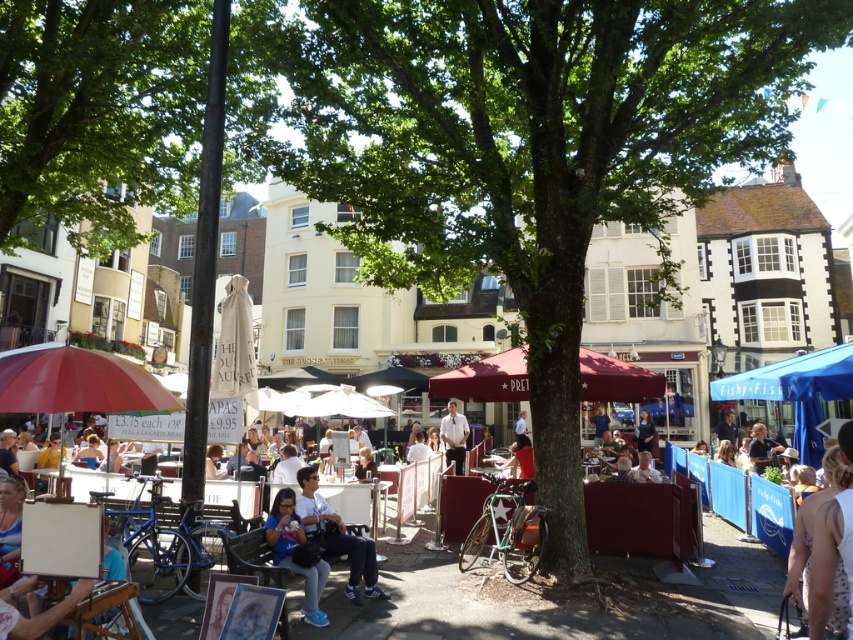
Between white floral dress at lower right and blue denim jeans at center, which one has more height?

white floral dress at lower right

The height and width of the screenshot is (640, 853). In order to click on white floral dress at lower right in this screenshot , I will do pos(822,540).

I want to click on white floral dress at lower right, so click(822, 540).

Between green leafy tree at center and light blue jeans at center, which one appears on the left side from the viewer's perspective?

light blue jeans at center

How far apart are green leafy tree at center and light blue jeans at center?

A distance of 6.23 meters exists between green leafy tree at center and light blue jeans at center.

Does point (697, 26) come farther from viewer compared to point (325, 540)?

Yes, it is.

You are a GUI agent. You are given a task and a screenshot of the screen. Output one action in this format:
    pyautogui.click(x=<x>, y=<y>)
    Task: Click on the green leafy tree at center
    The width and height of the screenshot is (853, 640).
    Given the screenshot: What is the action you would take?
    pyautogui.click(x=532, y=148)

Between white fabric umbrella at center and white floral dress at lower right, which one is positioned lower?

white fabric umbrella at center

Is white fabric umbrella at center wider than white floral dress at lower right?

Incorrect, white fabric umbrella at center's width does not surpass white floral dress at lower right's.

I want to click on white fabric umbrella at center, so point(552,593).